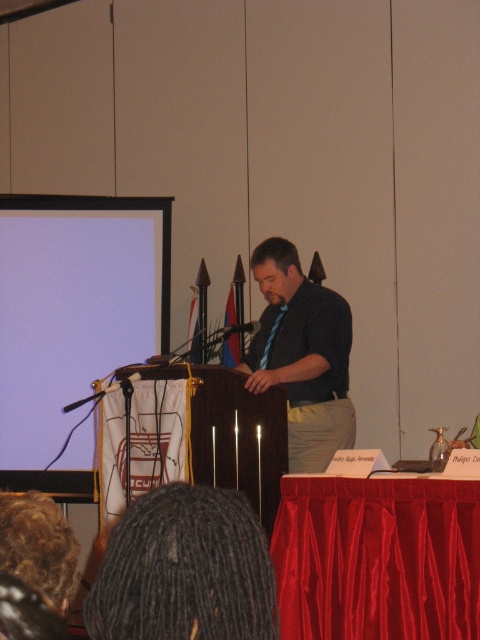
Question: Which point is farther from the camera taking this photo?

Choices:
 (A) (273, 269)
 (B) (137, 544)
 (C) (167, 262)

Answer: (C)

Question: Estimate the real-world distances between objects in this image. Which object is farther from the dark blue shirt at center?

Choices:
 (A) dark dreadlocks at lower center
 (B) white matte projection screen at upper left

Answer: (A)

Question: Is dark dreadlocks at lower center above dark blue shirt at center?

Choices:
 (A) no
 (B) yes

Answer: (A)

Question: Considering the real-world distances, which object is closest to the dark blue shirt at center?

Choices:
 (A) white matte projection screen at upper left
 (B) dark dreadlocks at lower center

Answer: (A)

Question: Does white matte projection screen at upper left have a lesser width compared to dark dreadlocks at lower center?

Choices:
 (A) yes
 (B) no

Answer: (B)

Question: Can you confirm if white matte projection screen at upper left is smaller than dark blue shirt at center?

Choices:
 (A) no
 (B) yes

Answer: (B)